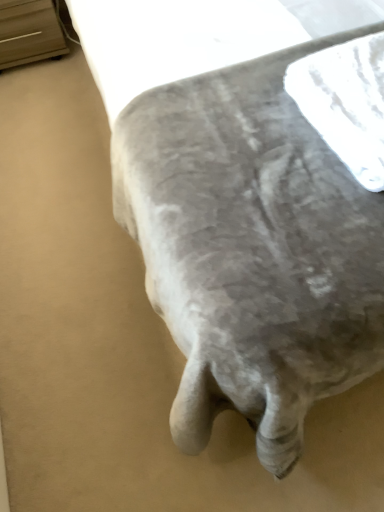
The height and width of the screenshot is (512, 384). Find the location of `white textured fabric at center`. white textured fabric at center is located at coordinates (346, 103).

What do you see at coordinates (346, 103) in the screenshot?
I see `white textured fabric at center` at bounding box center [346, 103].

The height and width of the screenshot is (512, 384). Describe the element at coordinates (29, 33) in the screenshot. I see `matte wood dresser at upper left` at that location.

At what (x,y) coordinates should I click in order to perform the action: click on matte wood dresser at upper left. Please return your answer as a coordinate pair (x, y). This screenshot has width=384, height=512. Looking at the image, I should click on (29, 33).

The image size is (384, 512). In order to click on white textured fabric at center in this screenshot , I will do click(346, 103).

Is matte wood dresser at upper left at the left side of white textured fabric at center?

Yes.

Which object is further away from the camera taking this photo, matte wood dresser at upper left or white textured fabric at center?

Positioned behind is matte wood dresser at upper left.

Which is behind, point (53, 50) or point (332, 127)?

The point (53, 50) is farther.

From the image's perspective, is matte wood dresser at upper left on white textured fabric at center?

Correct, matte wood dresser at upper left appears higher than white textured fabric at center in the image.

From a real-world perspective, who is located lower, matte wood dresser at upper left or white textured fabric at center?

matte wood dresser at upper left, from a real-world perspective.

Considering the sizes of objects matte wood dresser at upper left and white textured fabric at center in the image provided, who is thinner, matte wood dresser at upper left or white textured fabric at center?

white textured fabric at center.

Between matte wood dresser at upper left and white textured fabric at center, which one has less height?

white textured fabric at center.

Does matte wood dresser at upper left have a larger size compared to white textured fabric at center?

Indeed, matte wood dresser at upper left has a larger size compared to white textured fabric at center.

In the scene shown: Would you say matte wood dresser at upper left is outside white textured fabric at center?

Indeed, matte wood dresser at upper left is completely outside white textured fabric at center.

Would you consider matte wood dresser at upper left to be distant from white textured fabric at center?

matte wood dresser at upper left is positioned a significant distance from white textured fabric at center.

Is matte wood dresser at upper left looking in the opposite direction of white textured fabric at center?

That's not correct — matte wood dresser at upper left is not looking away from white textured fabric at center.

How many degrees apart are the facing directions of matte wood dresser at upper left and white textured fabric at center?

They differ by 3.47 degrees in their facing directions.

Measure the distance between matte wood dresser at upper left and white textured fabric at center.

matte wood dresser at upper left and white textured fabric at center are 4.58 feet apart.

This screenshot has height=512, width=384. I want to click on linen located below the matte wood dresser at upper left (from the image's perspective), so click(x=346, y=103).

Considering the positions of objects white textured fabric at center and matte wood dresser at upper left in the image provided, who is more to the right, white textured fabric at center or matte wood dresser at upper left?

white textured fabric at center is more to the right.

In the image, is white textured fabric at center positioned in front of or behind matte wood dresser at upper left?

In the image, white textured fabric at center appears in front of matte wood dresser at upper left.

Which is in front, point (310, 91) or point (34, 16)?

Positioned in front is point (310, 91).

From the image's perspective, does white textured fabric at center appear lower than matte wood dresser at upper left?

Correct, white textured fabric at center appears lower than matte wood dresser at upper left in the image.

From a real-world perspective, which object stands above the other?

From a 3D spatial view, white textured fabric at center is above.

Consider the image. Between white textured fabric at center and matte wood dresser at upper left, which one has larger width?

With larger width is matte wood dresser at upper left.

Can you confirm if white textured fabric at center is taller than matte wood dresser at upper left?

Incorrect, the height of white textured fabric at center is not larger of that of matte wood dresser at upper left.

Who is bigger, white textured fabric at center or matte wood dresser at upper left?

matte wood dresser at upper left.

Is white textured fabric at center inside the boundaries of matte wood dresser at upper left, or outside?

white textured fabric at center is not inside matte wood dresser at upper left, it's outside.

Is white textured fabric at center in contact with matte wood dresser at upper left?

white textured fabric at center and matte wood dresser at upper left are clearly separated.

Is white textured fabric at center looking in the opposite direction of matte wood dresser at upper left?

white textured fabric at center is not turned away from matte wood dresser at upper left.

Can you tell me how much white textured fabric at center and matte wood dresser at upper left differ in facing direction?

white textured fabric at center and matte wood dresser at upper left are facing 3.47 degrees away from each other.

Locate an element on the screen. The image size is (384, 512). linen located in front of the matte wood dresser at upper left is located at coordinates (346, 103).

This screenshot has height=512, width=384. Identify the location of linen below the matte wood dresser at upper left (from the image's perspective). (346, 103).

The image size is (384, 512). In order to click on furniture below the white textured fabric at center (from a real-world perspective) in this screenshot , I will do tap(29, 33).